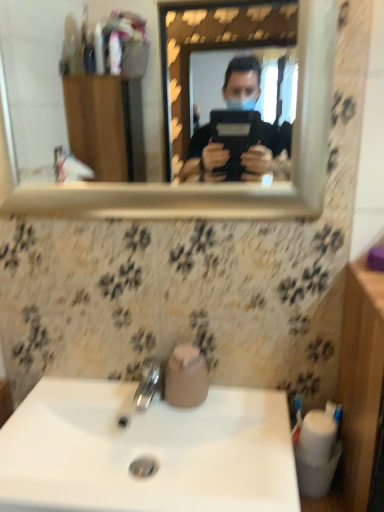
Where is `vacant space underneath gold-framed mirror at upper center (from a real-world perspective)`? The height and width of the screenshot is (512, 384). vacant space underneath gold-framed mirror at upper center (from a real-world perspective) is located at coordinates click(138, 380).